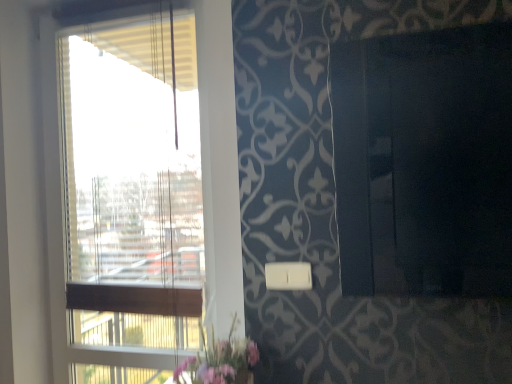
Question: Does pink fabric floral arrangement at lower center have a lesser width compared to transparent glass window at left?

Choices:
 (A) no
 (B) yes

Answer: (A)

Question: Is pink fabric floral arrangement at lower center positioned with its back to transparent glass window at left?

Choices:
 (A) no
 (B) yes

Answer: (A)

Question: From a real-world perspective, is pink fabric floral arrangement at lower center positioned over transparent glass window at left based on gravity?

Choices:
 (A) no
 (B) yes

Answer: (A)

Question: Is pink fabric floral arrangement at lower center with transparent glass window at left?

Choices:
 (A) yes
 (B) no

Answer: (B)

Question: Does pink fabric floral arrangement at lower center contain transparent glass window at left?

Choices:
 (A) no
 (B) yes

Answer: (A)

Question: From the image's perspective, is pink fabric floral arrangement at lower center located beneath transparent glass window at left?

Choices:
 (A) yes
 (B) no

Answer: (A)

Question: Is transparent glass window at left positioned with its back to pink fabric floral arrangement at lower center?

Choices:
 (A) no
 (B) yes

Answer: (A)

Question: Can you confirm if transparent glass window at left is bigger than pink fabric floral arrangement at lower center?

Choices:
 (A) no
 (B) yes

Answer: (B)

Question: From a real-world perspective, is transparent glass window at left located higher than pink fabric floral arrangement at lower center?

Choices:
 (A) yes
 (B) no

Answer: (A)

Question: Is transparent glass window at left at the right side of pink fabric floral arrangement at lower center?

Choices:
 (A) no
 (B) yes

Answer: (A)

Question: From a real-world perspective, is transparent glass window at left positioned under pink fabric floral arrangement at lower center based on gravity?

Choices:
 (A) yes
 (B) no

Answer: (B)

Question: Is transparent glass window at left taller than pink fabric floral arrangement at lower center?

Choices:
 (A) no
 (B) yes

Answer: (B)

Question: Is pink fabric floral arrangement at lower center shorter than white plastic light switch at lower center?

Choices:
 (A) no
 (B) yes

Answer: (A)